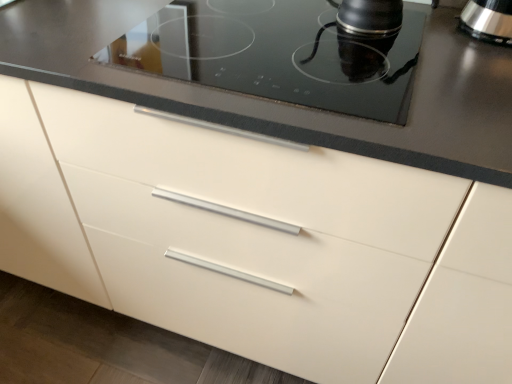
Where is `vacant region above black glass cooktop at upper center (from a real-world perspective)`? vacant region above black glass cooktop at upper center (from a real-world perspective) is located at coordinates (284, 38).